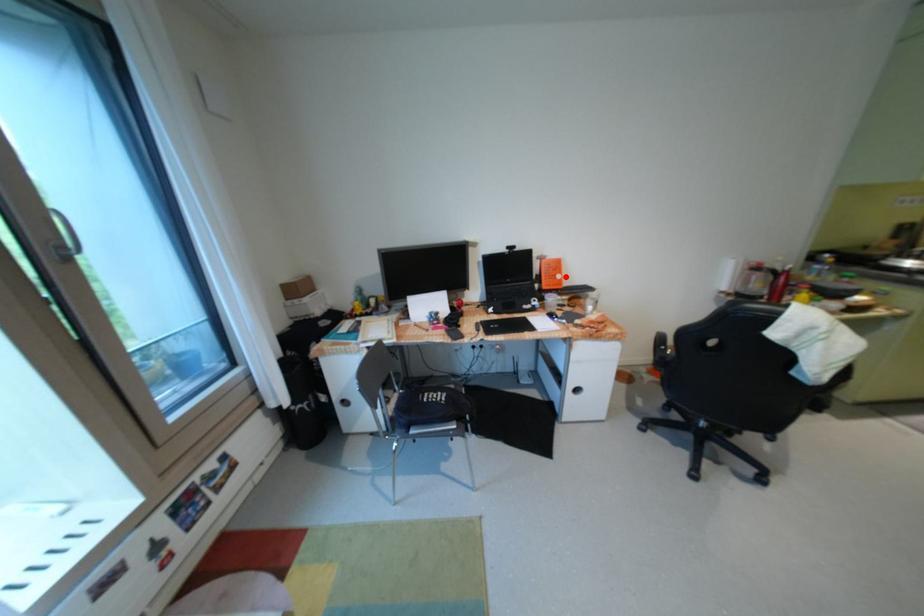
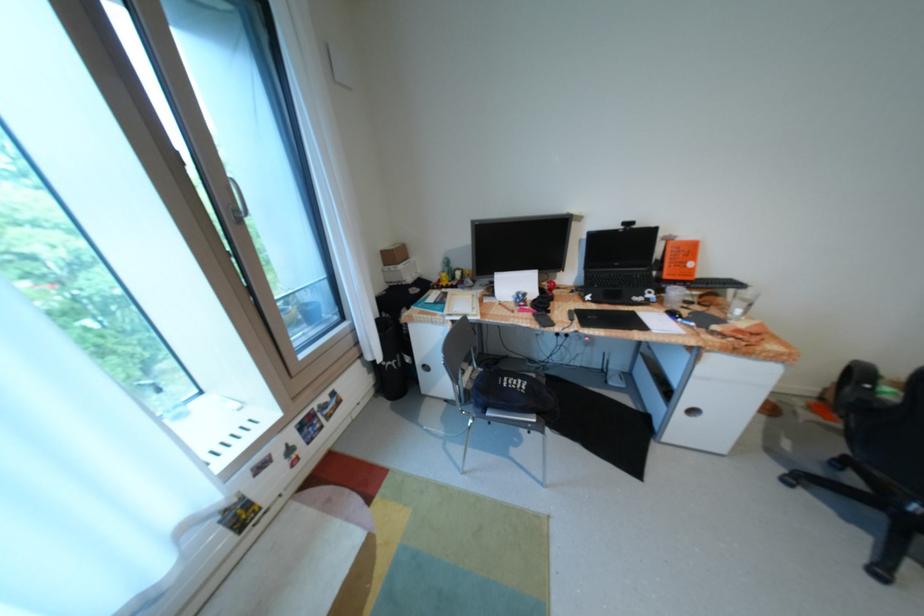
In the second image, find the point that corresponds to the highlighted location in the first image.

(697, 264)